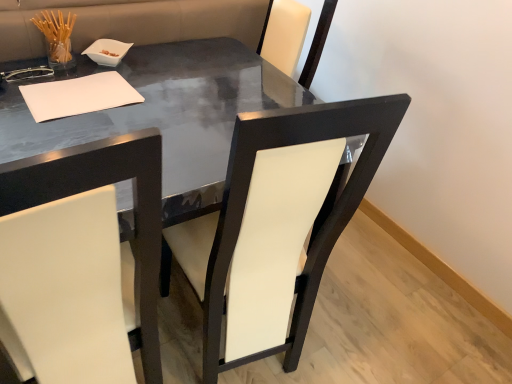
Where is `free spot in front of white paper at upper left`? The image size is (512, 384). free spot in front of white paper at upper left is located at coordinates (54, 130).